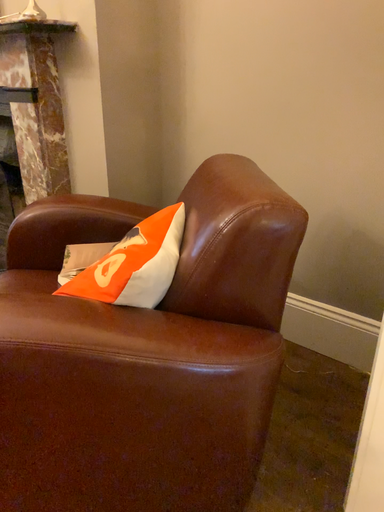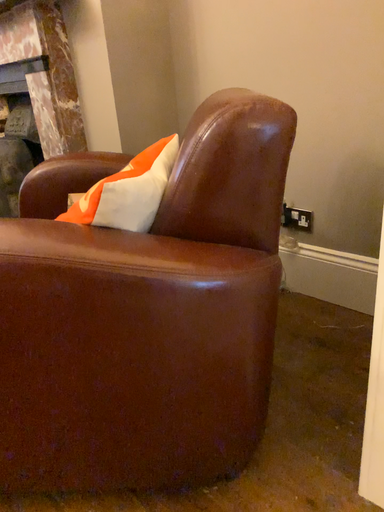
Question: Which way did the camera rotate in the video?

Choices:
 (A) rotated right
 (B) rotated left

Answer: (B)